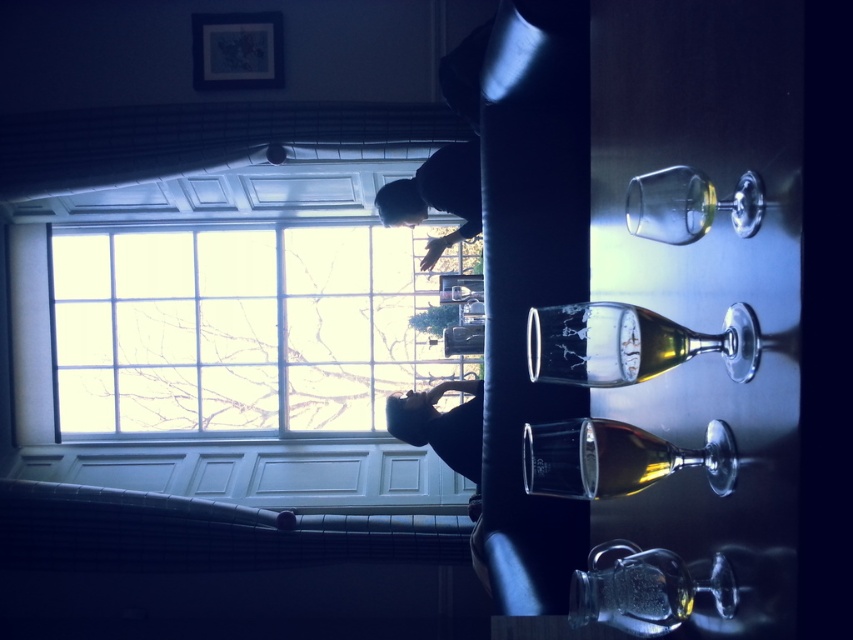
Does clear glass window at upper left have a greater height compared to transparent glass wine bottle at center?

Yes.

Can you confirm if clear glass window at upper left is positioned to the left of transparent glass wine bottle at center?

Correct, you'll find clear glass window at upper left to the left of transparent glass wine bottle at center.

What do you see at coordinates (241, 328) in the screenshot?
I see `clear glass window at upper left` at bounding box center [241, 328].

Identify the location of clear glass window at upper left. (241, 328).

Consider the image. Can you confirm if clear glass window at upper left is smaller than translucent glass wine bottle at center?

Actually, clear glass window at upper left might be larger than translucent glass wine bottle at center.

Is point (386, 256) farther from viewer compared to point (640, 340)?

Yes, it is behind point (640, 340).

Is point (326, 252) farther from viewer compared to point (740, 380)?

Yes, point (326, 252) is behind point (740, 380).

The image size is (853, 640). Identify the location of clear glass window at upper left. (241, 328).

Is clear glass window at upper left smaller than translucent glass bottle at center?

Actually, clear glass window at upper left might be larger than translucent glass bottle at center.

Who is positioned more to the right, clear glass window at upper left or translucent glass bottle at center?

Positioned to the right is translucent glass bottle at center.

Image resolution: width=853 pixels, height=640 pixels. I want to click on clear glass window at upper left, so click(x=241, y=328).